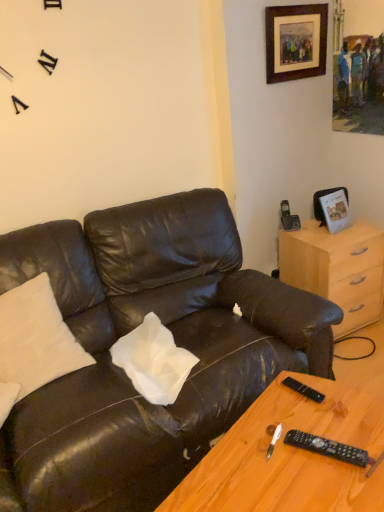
I want to click on vacant area that lies between black plastic remote at lower right, acting as the second remote starting from the back, and black plastic remote at lower right, which is the first remote in top-to-bottom order, so 311,419.